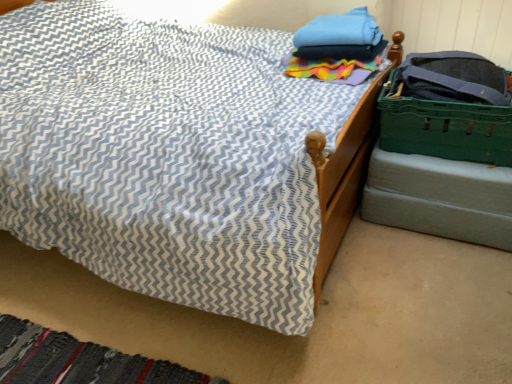
Question: Does green plastic crate at lower right have a greater width compared to blue cotton towels at upper right?

Choices:
 (A) yes
 (B) no

Answer: (A)

Question: Is green plastic crate at lower right behind blue cotton towels at upper right?

Choices:
 (A) no
 (B) yes

Answer: (A)

Question: Can you see green plastic crate at lower right touching blue cotton towels at upper right?

Choices:
 (A) no
 (B) yes

Answer: (A)

Question: Considering the relative sizes of green plastic crate at lower right and blue cotton towels at upper right in the image provided, is green plastic crate at lower right taller than blue cotton towels at upper right?

Choices:
 (A) no
 (B) yes

Answer: (B)

Question: From a real-world perspective, is green plastic crate at lower right over blue cotton towels at upper right?

Choices:
 (A) yes
 (B) no

Answer: (B)

Question: From a real-world perspective, is blue cotton towels at upper right physically located above or below green plastic crate at lower right?

Choices:
 (A) above
 (B) below

Answer: (A)

Question: From the image's perspective, is blue cotton towels at upper right positioned above or below green plastic crate at lower right?

Choices:
 (A) below
 (B) above

Answer: (B)

Question: Considering the positions of blue cotton towels at upper right and green plastic crate at lower right in the image, is blue cotton towels at upper right wider or thinner than green plastic crate at lower right?

Choices:
 (A) thin
 (B) wide

Answer: (A)

Question: Considering the relative positions of blue cotton towels at upper right and green plastic crate at lower right in the image provided, is blue cotton towels at upper right to the left or to the right of green plastic crate at lower right?

Choices:
 (A) left
 (B) right

Answer: (A)

Question: Relative to green plastic crate at right, is textured fabric bed at center in front or behind?

Choices:
 (A) behind
 (B) front

Answer: (B)

Question: From a real-world perspective, relative to green plastic crate at right, is textured fabric bed at center vertically above or below?

Choices:
 (A) above
 (B) below

Answer: (B)

Question: From their relative heights in the image, would you say textured fabric bed at center is taller or shorter than green plastic crate at right?

Choices:
 (A) short
 (B) tall

Answer: (A)

Question: Is point (242, 59) positioned closer to the camera than point (505, 125)?

Choices:
 (A) farther
 (B) closer

Answer: (A)

Question: Is textured fabric bed at center taller or shorter than blue cotton towels at upper right?

Choices:
 (A) tall
 (B) short

Answer: (B)

Question: From a real-world perspective, is textured fabric bed at center above or below blue cotton towels at upper right?

Choices:
 (A) below
 (B) above

Answer: (A)